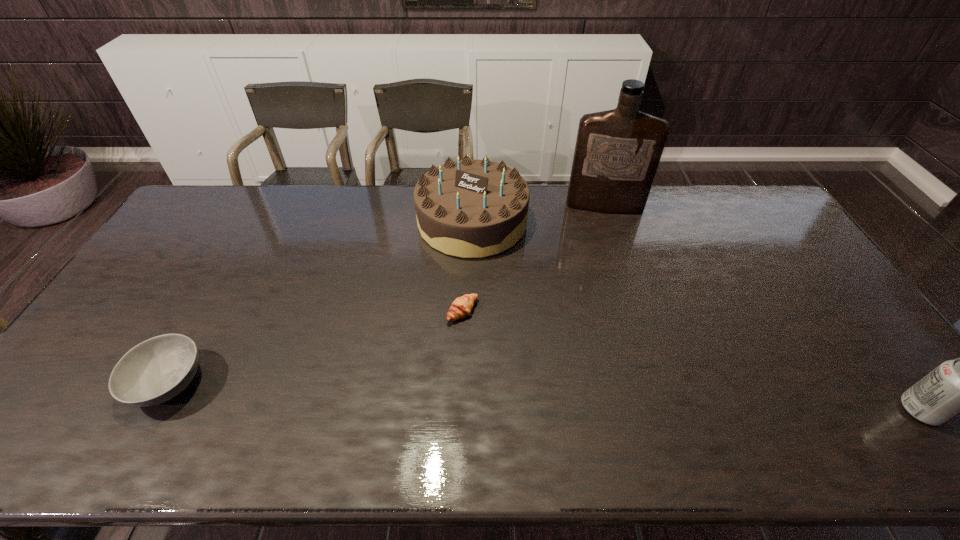
Where is `object that is the fourth closest one to the bowl`? The height and width of the screenshot is (540, 960). object that is the fourth closest one to the bowl is located at coordinates (959, 386).

This screenshot has width=960, height=540. Identify the location of object that is the second closest to the third shortest object. (469, 208).

At what (x,y) coordinates should I click in order to perform the action: click on vacant position in the image that satisfies the following two spatial constraints: 1. on the back side of the second object from right to left; 2. on the left side of the second tallest object. Please return your answer as a coordinate pair (x, y). This screenshot has height=540, width=960. Looking at the image, I should click on (472, 206).

You are a GUI agent. You are given a task and a screenshot of the screen. Output one action in this format:
    pyautogui.click(x=<x>, y=<y>)
    Task: Click on the blank area in the image that satisfies the following two spatial constraints: 1. on the back side of the third farthest object; 2. on the left side of the birthday cake
    The width and height of the screenshot is (960, 540).
    Given the screenshot: What is the action you would take?
    pyautogui.click(x=466, y=222)